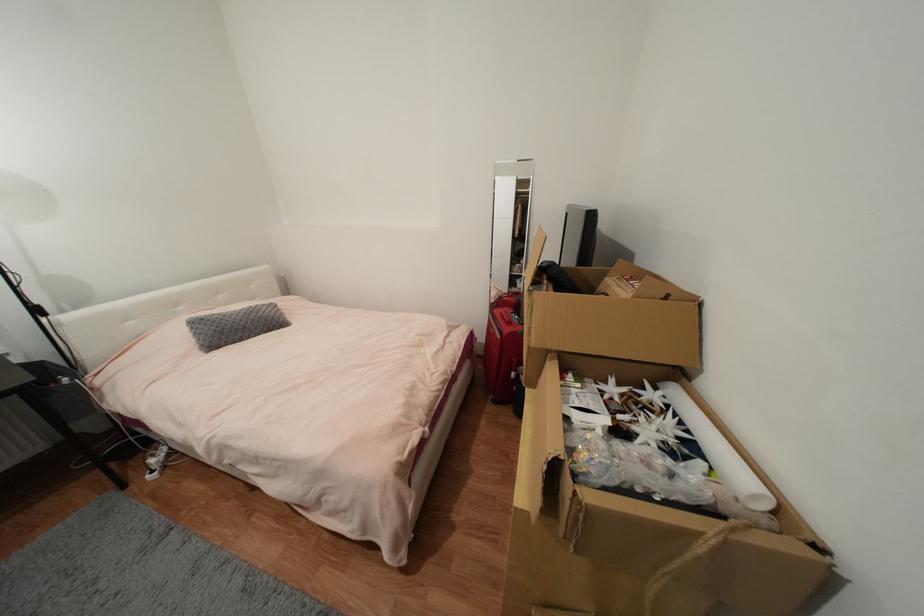
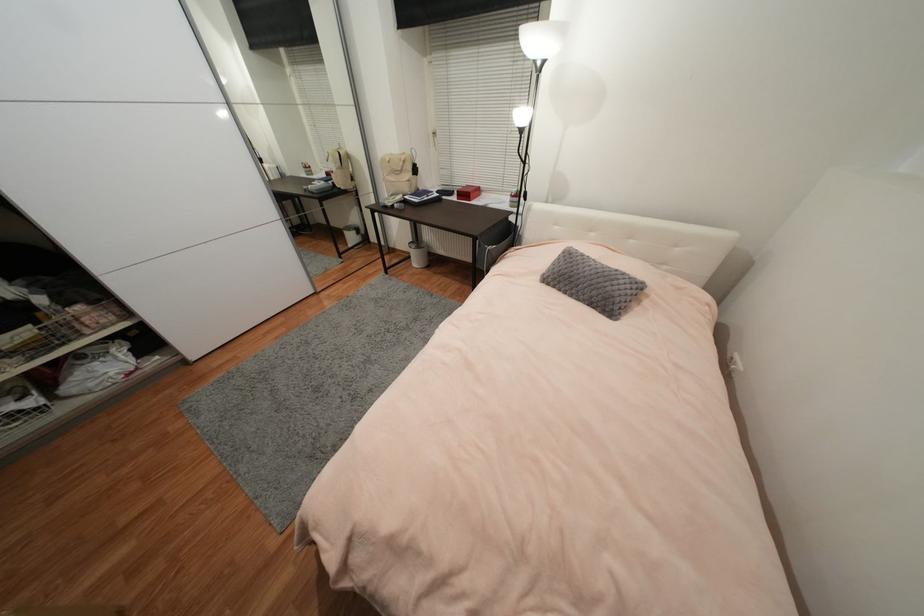
The point at (246,341) is marked in the first image. Where is the corresponding point in the second image?

(569, 294)